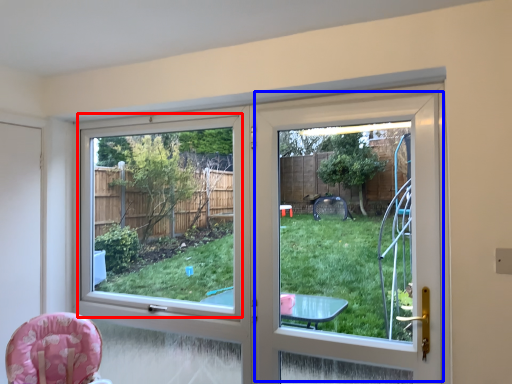
Question: Which of the following is the farthest to the observer, window screen (highlighted by a red box) or screen door (highlighted by a blue box)?

Choices:
 (A) window screen
 (B) screen door

Answer: (A)